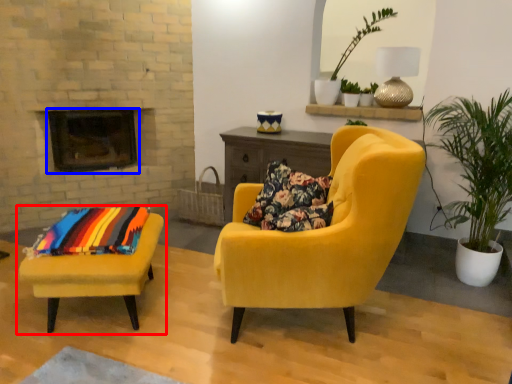
Question: Which point is closer to the camera, chair (highlighted by a red box) or fireplace (highlighted by a blue box)?

Choices:
 (A) chair
 (B) fireplace

Answer: (A)